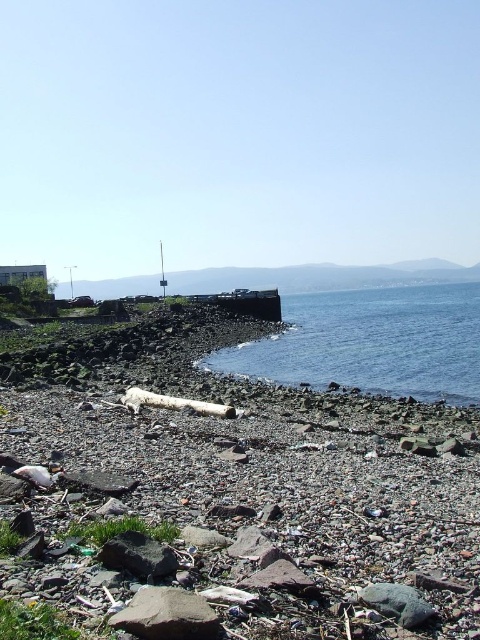
Question: Which of the following is the farthest from the observer?

Choices:
 (A) gray rough rock at lower center
 (B) rough stone beach at lower left
 (C) blue water at center

Answer: (C)

Question: Estimate the real-world distances between objects in this image. Which object is closer to the dark gray rock at lower center?

Choices:
 (A) blue water at center
 (B) gray rough rock at lower center

Answer: (B)

Question: Is rough stone beach at lower left wider than dark gray rock at lower center?

Choices:
 (A) no
 (B) yes

Answer: (B)

Question: Is rough stone beach at lower left positioned in front of blue water at center?

Choices:
 (A) no
 (B) yes

Answer: (B)

Question: Which point is closer to the camera taking this photo?

Choices:
 (A) (149, 545)
 (B) (49, 566)
 (C) (393, 353)

Answer: (B)

Question: Does rough stone beach at lower left appear on the right side of blue water at center?

Choices:
 (A) yes
 (B) no

Answer: (B)